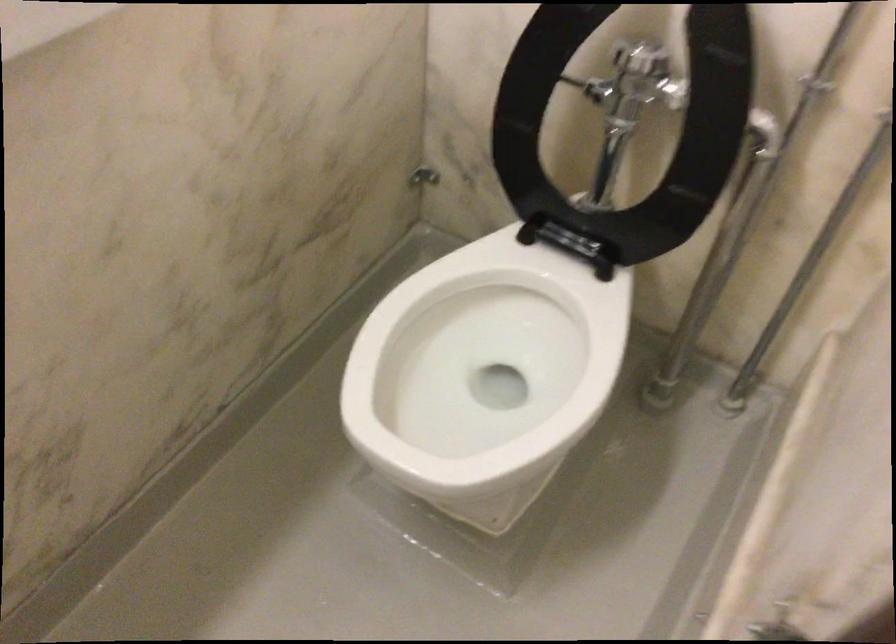
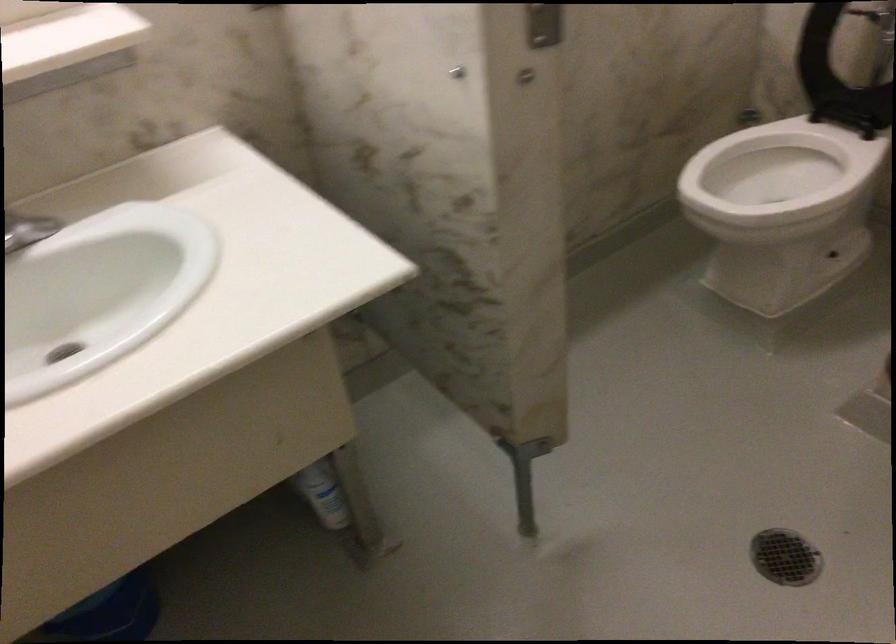
Question: I am providing you with two images of the same scene from different viewpoints. Which of the following objects are not visible in image2?

Choices:
 (A) silver faucet handle
 (B) metal stall lock
 (C) green valve knob
 (D) black toilet seat

Answer: (D)